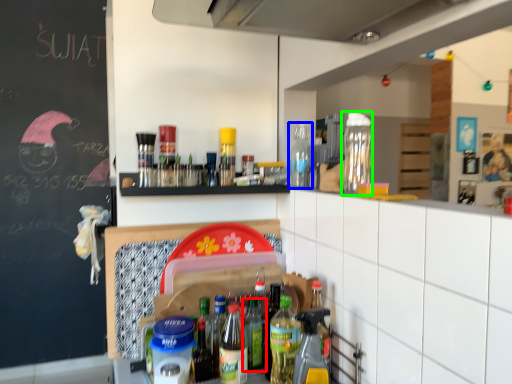
Question: Based on their relative distances, which object is nearer to bottle (highlighted by a red box)? Choose from bottle (highlighted by a blue box) and bottle (highlighted by a green box).

Choices:
 (A) bottle
 (B) bottle

Answer: (A)